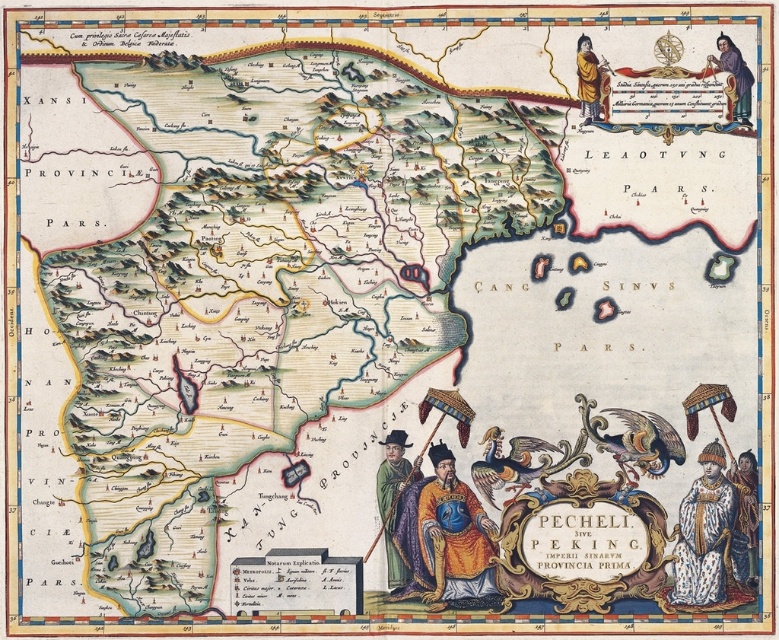
You are an anthropologist examining this historical map and notice two garments depicted near the bottom of the map. The golden silk robe at lower center and the white fur coat at lower right. Which of these garments is shorter in height?

The golden silk robe at lower center is not as tall as the white fur coat at lower right, so the golden silk robe at lower center is shorter in height.

From the picture: You are an antique dealer examining the historical map. You notice two silk robes depicted on it. Which one, the golden silk robe at lower center or the silk robe at lower right, is larger in size?

The golden silk robe at lower center is bigger than the silk robe at lower right according to the map.

You are an art conservator examining the map and notice two silk robes depicted on it. The golden silk robe at lower center and the silk robe at lower right. Which robe appears taller in the depiction?

The golden silk robe at lower center appears taller than the silk robe at lower right as stated in the description.